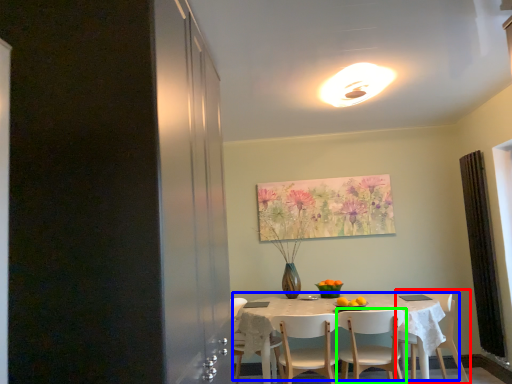
Question: Based on their relative distances, which object is farther from chair (highlighted by a red box)? Choose from kitchen & dining room table (highlighted by a blue box) and chair (highlighted by a green box).

Choices:
 (A) kitchen & dining room table
 (B) chair

Answer: (A)